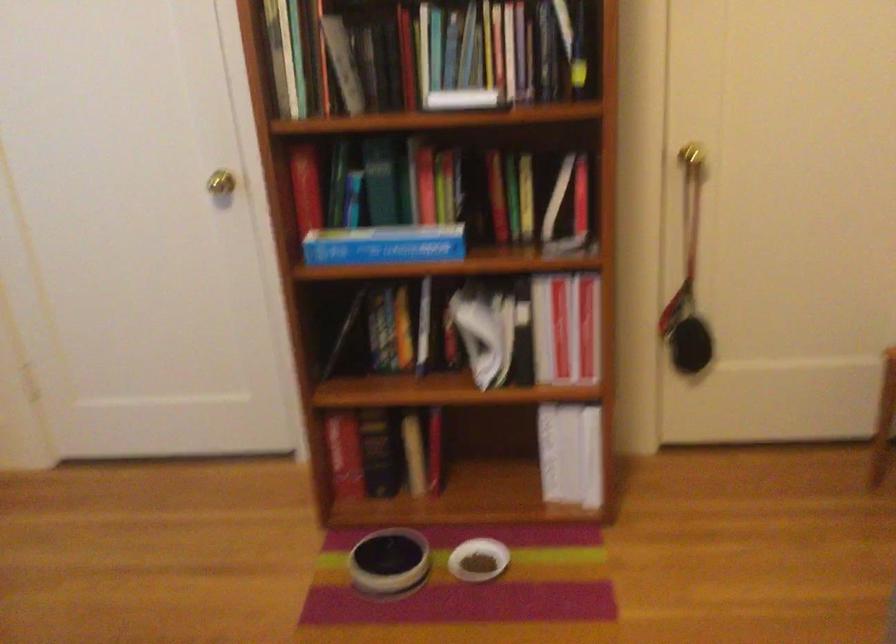
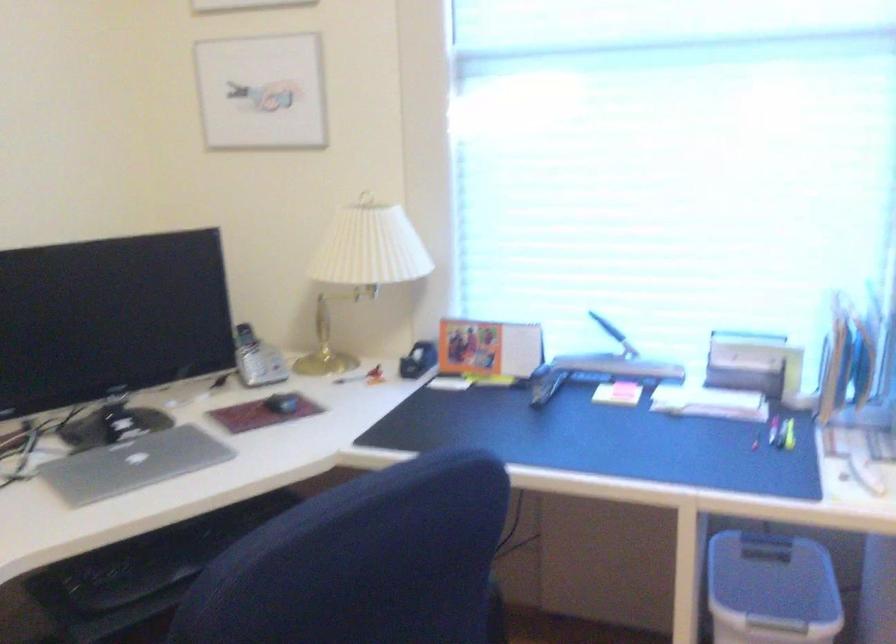
Based on the continuous images, in which direction is the camera rotating?

The camera's rotation is toward left-down.